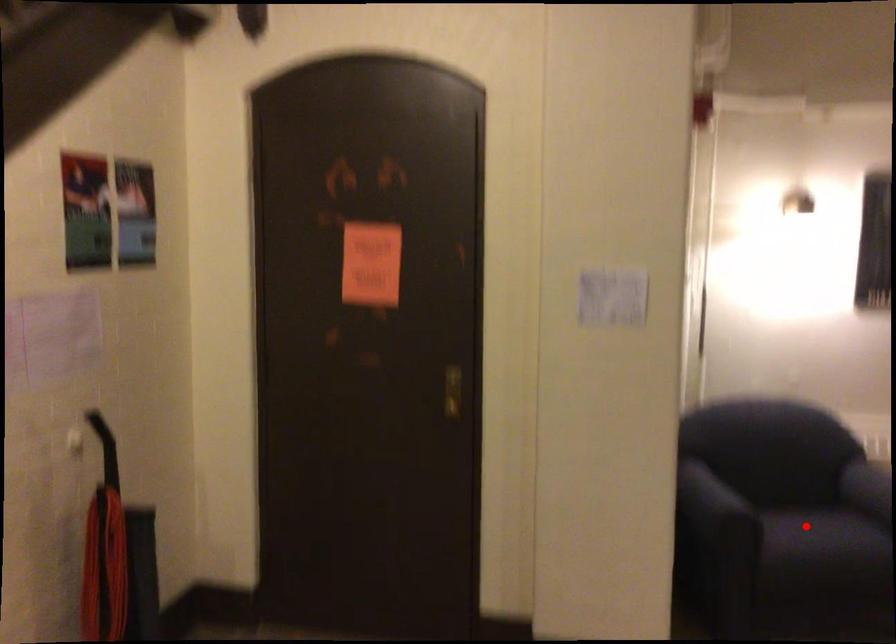
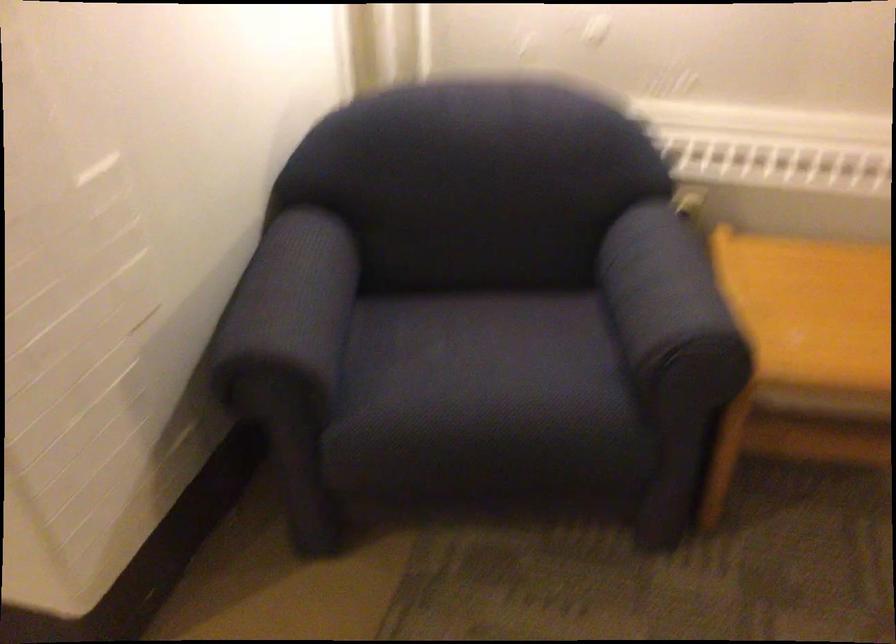
Question: I am providing you with two images of the same scene from different viewpoints. In image1, a red point is highlighted. Considering the same 3D point in image2, which of the following is correct?

Choices:
 (A) It is closer
 (B) It is farther

Answer: (A)